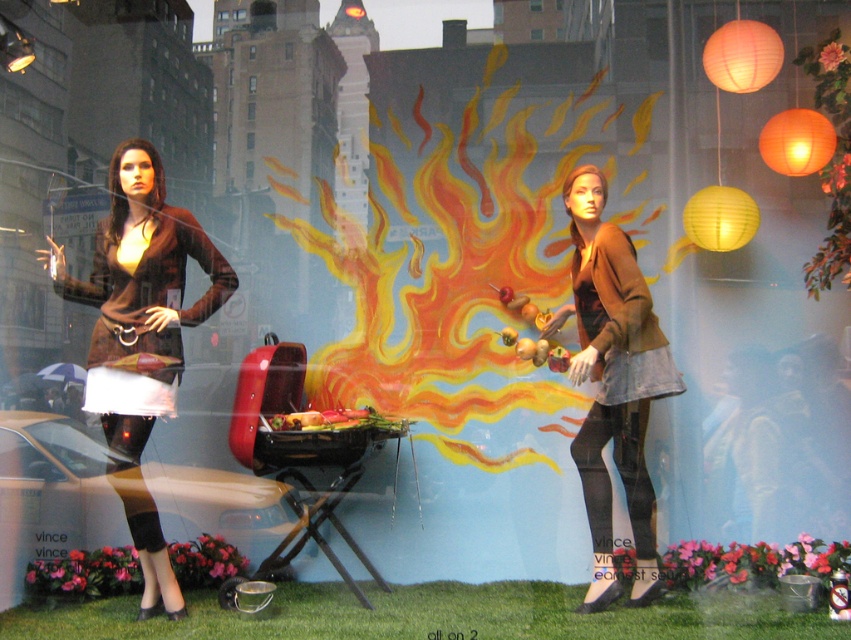
You are a customer standing in front of the window display. You notice two points marked in the scene. Which point, point 1 at coordinates [113,464] or point 2 at coordinates [615,241], is closer to you?

Point 1 at coordinates [113,464] is closer to you than point 2 at coordinates [615,241].

You are a customer looking at the window display and want to know which item is taller between the matte brown sweater at left and the matte brown jacket at center. Can you tell me?

The matte brown sweater at left is much taller than the matte brown jacket at center.